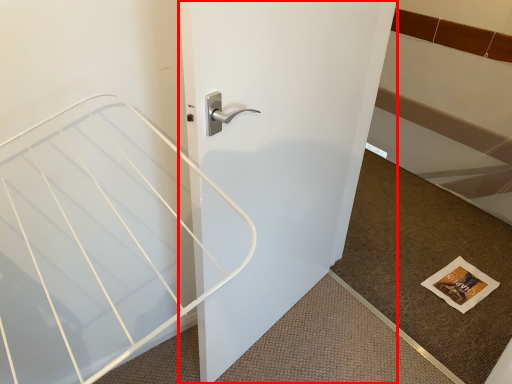
Question: From the image's perspective, where is door (annotated by the red box) located in relation to doormat in the image?

Choices:
 (A) below
 (B) above

Answer: (B)